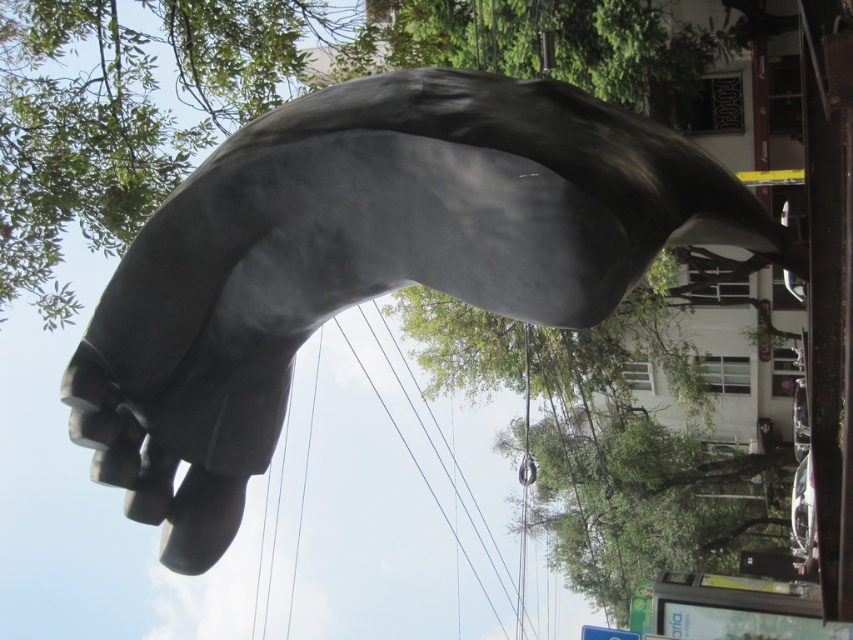
You are an urban planner analyzing the sculpture and tree placement in the image. Given the presence of the satin gray hand at center and the green leafy tree at center, which object is located to the left when viewed from the street?

The satin gray hand at center is positioned on the left side of the green leafy tree at center, so it is located to the left when viewed from the street.

You are a photographer trying to capture both the satin gray hand at center and the green leafy tree at center in a single frame. Based on their sizes, which object should you focus on first to ensure both are fully visible in your photo?

The satin gray hand at center is taller than the green leafy tree at center, so you should focus on the satin gray hand at center first to ensure both are fully visible in your photo.

You are an urban planner assessing a public space. You notice the satin gray hand at center and the green leafy tree at center in the scene. Which object is located above the other?

The satin gray hand at center is positioned over the green leafy tree at center, meaning it is above the tree.